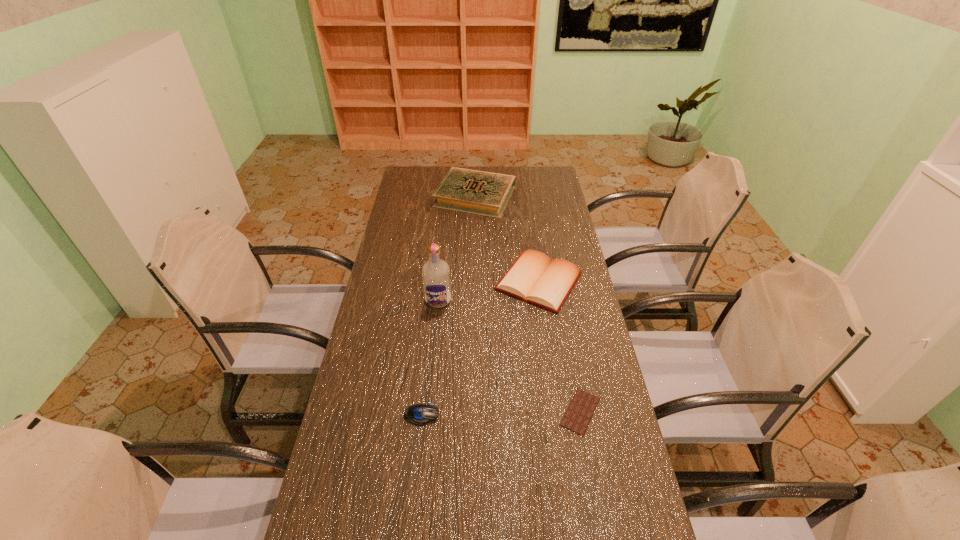
This screenshot has height=540, width=960. In order to click on vacant space that satisfies the following two spatial constraints: 1. on the label of the chocolate bar; 2. on the left side of the vodka in this screenshot , I will do `click(427, 411)`.

What are the coordinates of `free space in the image that satisfies the following two spatial constraints: 1. on the label of the tallest object; 2. on the right side of the shortest object` in the screenshot? It's located at (427, 411).

Find the location of a particular element. vacant space that satisfies the following two spatial constraints: 1. on the label of the chocolate bar; 2. on the right side of the vodka is located at coordinates (427, 411).